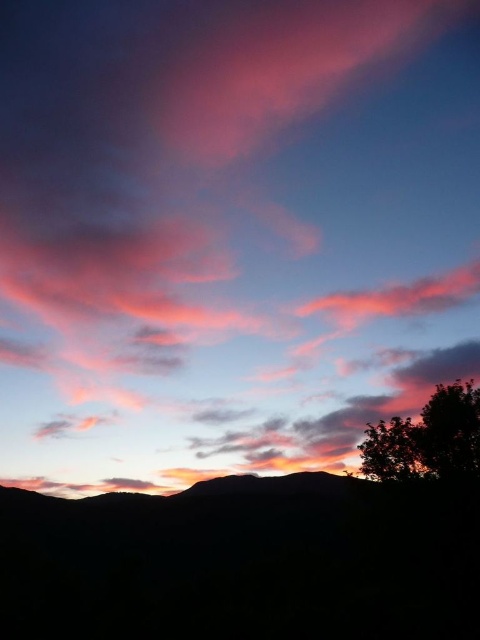
You are an artist trying to paint this sunset scene. You want to ensure the silhouette mountain at center and the dark green leafy tree at lower right are proportionally accurate. Based on the scene, which object should you draw wider?

The silhouette mountain at center should be drawn wider than the dark green leafy tree at lower right because the silhouette mountain at center might be wider than dark green leafy tree at lower right.

You are an artist painting this sunset scene. You want to ensure the silhouette mountain at center and the dark green leafy tree at lower right are placed correctly. Which object should be drawn first to maintain their spatial relationship?

The dark green leafy tree at lower right should be drawn first because the silhouette mountain at center is positioned under it, meaning the mountain is behind the tree and should be placed beneath it in the composition.